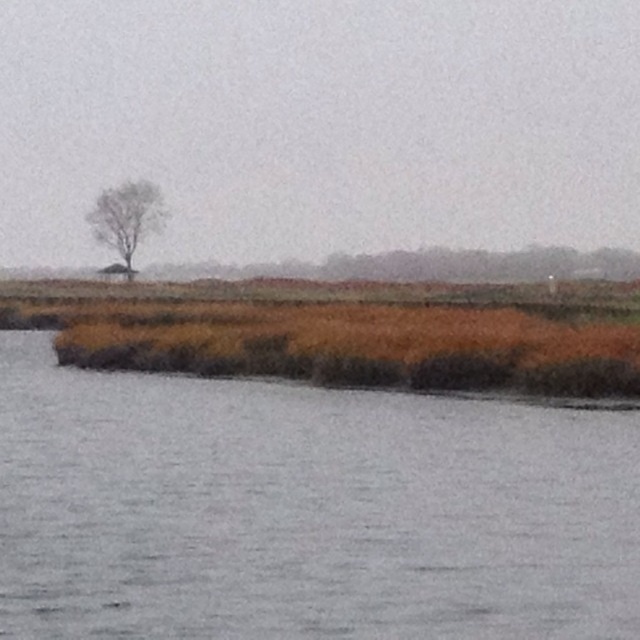
You are standing at the center of the image and want to walk towards the gray matte water at lower left. Which direction should you face to head directly towards it?

Since the gray matte water at lower left is located at point (305,509), you should face towards the lower left direction to head directly towards it.

Based on the photo, you are standing at the edge of a serene natural landscape with a body of water in front of you. You have a small boat that is 40 feet long. Can you determine if your boat will fit in the gray matte water at lower left?

The gray matte water at lower left is 39.86 feet from viewer. Since the boat is 40 feet long, it is slightly longer than the available space. Therefore, the boat will not fit in the gray matte water at lower left.

You are standing on the shore looking at the scene. Which object is closer to you between the gray matte water at lower left and the bare branches tree at upper left?

The gray matte water at lower left is closer to you because it is positioned below the bare branches tree at upper left, indicating it is in a lower, nearer part of the scene.